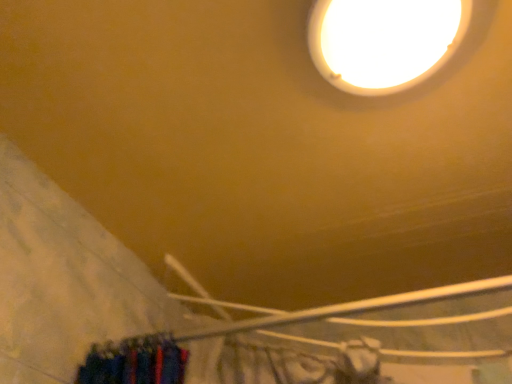
Identify the location of white glossy lamp at upper center. This screenshot has height=384, width=512. (384, 41).

Describe the element at coordinates (384, 41) in the screenshot. I see `white glossy lamp at upper center` at that location.

At what (x,y) coordinates should I click in order to perform the action: click on white glossy lamp at upper center. Please return your answer as a coordinate pair (x, y). This screenshot has width=512, height=384. Looking at the image, I should click on (384, 41).